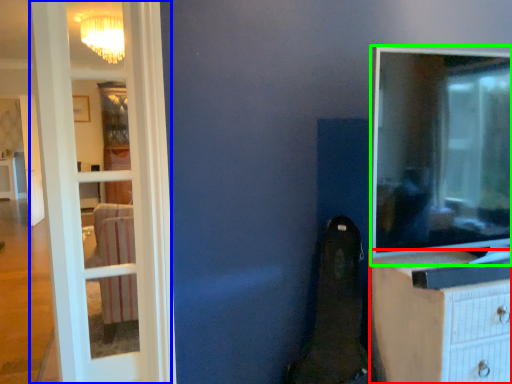
Question: Which object is the farthest from chest of drawers (highlighted by a red box)? Choose among these: door (highlighted by a blue box) or tv show (highlighted by a green box).

Choices:
 (A) door
 (B) tv show

Answer: (A)